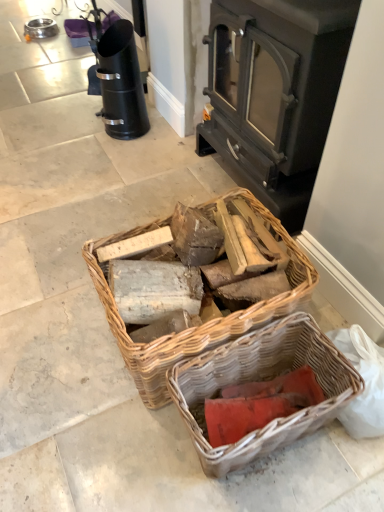
Find the location of `free point to the left of dark gray metal wood burning stove at center`. free point to the left of dark gray metal wood burning stove at center is located at coordinates (148, 178).